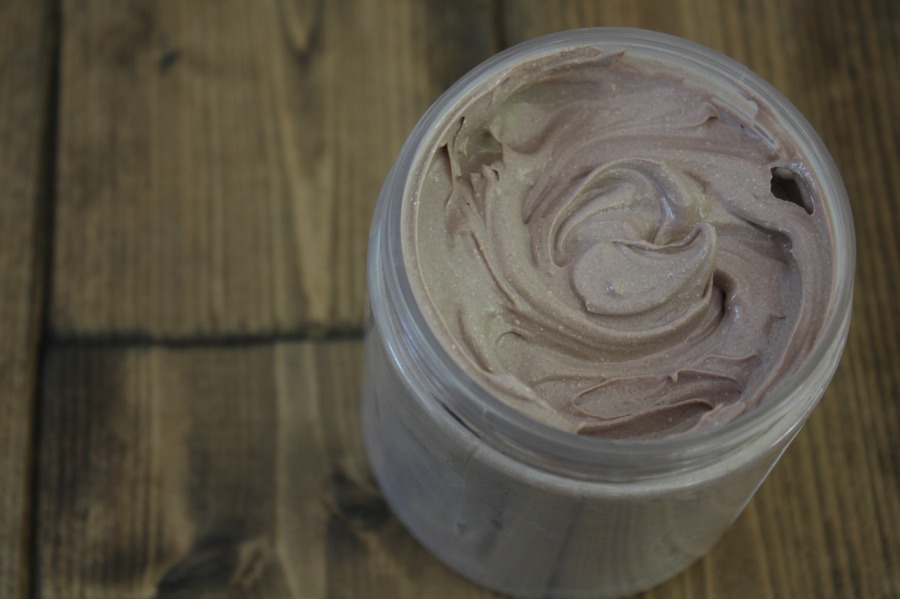
Identify the location of wooden surface. (32, 155), (121, 157), (191, 440), (821, 78).